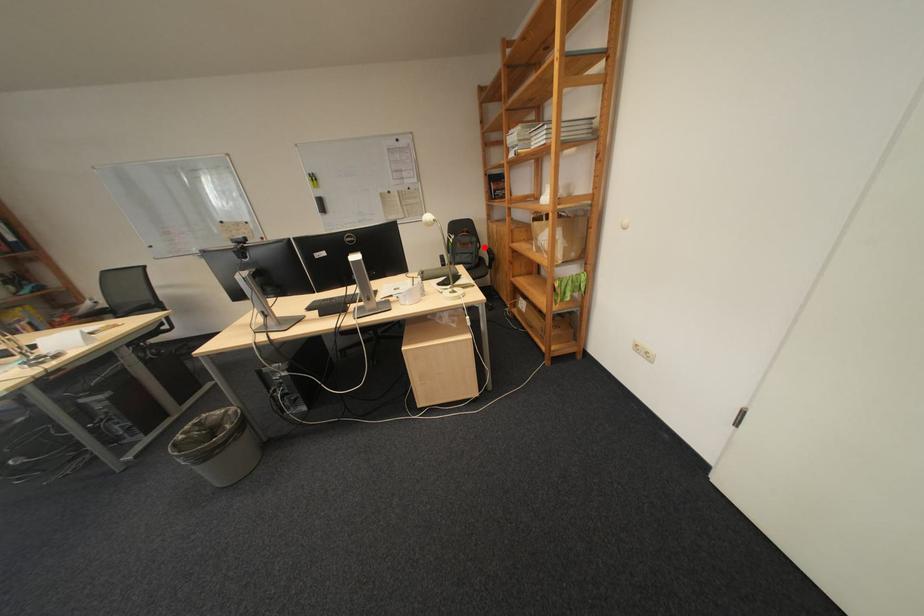
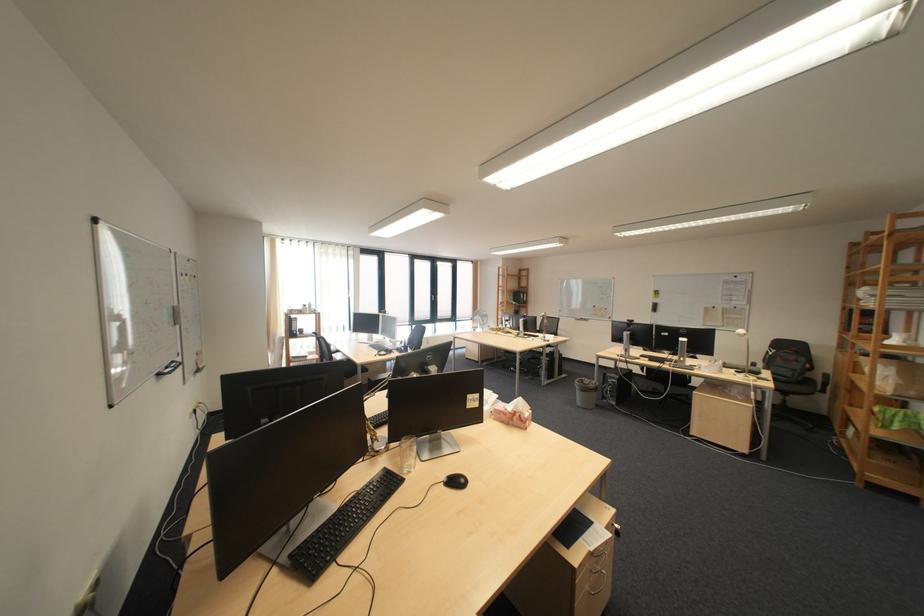
Question: I am providing you with two images of the same scene from different viewpoints. A red point is shown in image1. For the corresponding object point in image2, is it positioned nearer or farther from the camera?

Choices:
 (A) Nearer
 (B) Farther

Answer: (B)